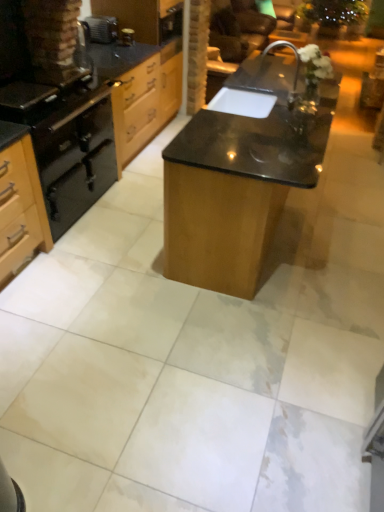
Question: Could you tell me if black matte oven at left is turned towards brushed metal toaster at upper left, the 2th appliance in the right-to-left sequence?

Choices:
 (A) no
 (B) yes

Answer: (A)

Question: Does black matte oven at left lie in front of brushed metal toaster at upper left, the first appliance from the left?

Choices:
 (A) no
 (B) yes

Answer: (B)

Question: Is black matte oven at left outside of brushed metal toaster at upper left, the first appliance from the left?

Choices:
 (A) no
 (B) yes

Answer: (B)

Question: Can you confirm if black matte oven at left is wider than brushed metal toaster at upper left, the 2th appliance in the right-to-left sequence?

Choices:
 (A) no
 (B) yes

Answer: (B)

Question: From the image's perspective, is black matte oven at left above brushed metal toaster at upper left, the 2th appliance in the right-to-left sequence?

Choices:
 (A) no
 (B) yes

Answer: (A)

Question: From a real-world perspective, is black matte oven at left below brushed metal toaster at upper left, the 2th appliance in the right-to-left sequence?

Choices:
 (A) no
 (B) yes

Answer: (B)

Question: From a real-world perspective, is brushed metal toaster at upper left, the 2th appliance in the right-to-left sequence, on top of matte black oven at left?

Choices:
 (A) yes
 (B) no

Answer: (A)

Question: Is the depth of brushed metal toaster at upper left, the first appliance from the left, less than that of matte black oven at left?

Choices:
 (A) no
 (B) yes

Answer: (A)

Question: Can you confirm if brushed metal toaster at upper left, the 2th appliance in the right-to-left sequence, is positioned to the right of matte black oven at left?

Choices:
 (A) no
 (B) yes

Answer: (B)

Question: Is brushed metal toaster at upper left, the 2th appliance in the right-to-left sequence, far from matte black oven at left?

Choices:
 (A) no
 (B) yes

Answer: (B)

Question: From a real-world perspective, is brushed metal toaster at upper left, the first appliance from the left, below matte black oven at left?

Choices:
 (A) yes
 (B) no

Answer: (B)

Question: Considering the relative sizes of brushed metal toaster at upper left, the first appliance from the left, and matte black oven at left in the image provided, is brushed metal toaster at upper left, the first appliance from the left, bigger than matte black oven at left?

Choices:
 (A) no
 (B) yes

Answer: (A)

Question: From a real-world perspective, is brushed metal toaster at upper left, the first appliance from the left, positioned under black matte gas stove at left based on gravity?

Choices:
 (A) no
 (B) yes

Answer: (A)